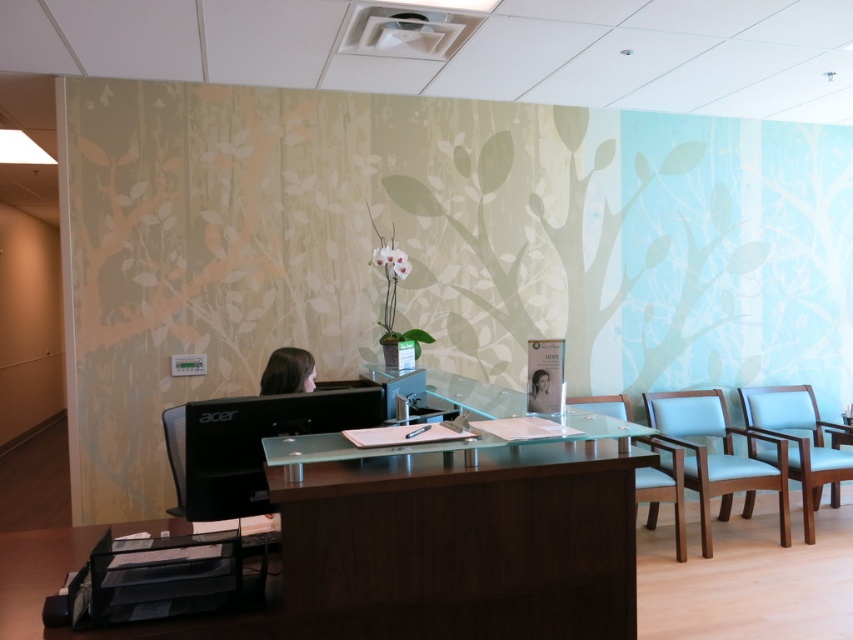
Question: Which of the following is the farthest from the observer?

Choices:
 (A) (345, 496)
 (B) (177, 454)

Answer: (B)

Question: Is light blue fabric armchair at right positioned in front of black mesh chair at left?

Choices:
 (A) yes
 (B) no

Answer: (B)

Question: Which is nearer to the dark brown wood table at center?

Choices:
 (A) brown matte hair at center
 (B) black plastic file organizer at lower left
 (C) black mesh chair at left

Answer: (A)

Question: Estimate the real-world distances between objects in this image. Which object is closer to the light blue fabric armchair at right?

Choices:
 (A) light blue fabric chair at right
 (B) brown matte hair at center
 (C) black mesh chair at left
 (D) light blue fabric chair at center

Answer: (D)

Question: Is dark brown wood table at center wider than black mesh chair at left?

Choices:
 (A) yes
 (B) no

Answer: (A)

Question: Is light blue fabric chair at right above brown matte hair at center?

Choices:
 (A) no
 (B) yes

Answer: (A)